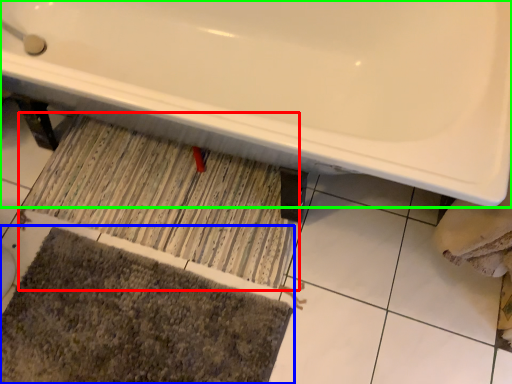
Question: Considering the real-world distances, which object is farthest from doormat (highlighted by a red box)? bath mat (highlighted by a blue box) or bathtub (highlighted by a green box)?

Choices:
 (A) bath mat
 (B) bathtub

Answer: (B)